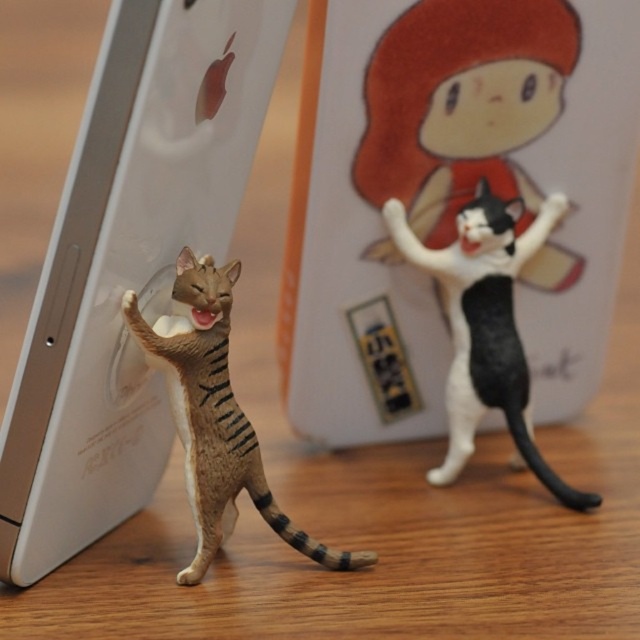
Question: Which object is the farthest from the brown striped cat at center?

Choices:
 (A) matte white phone at left
 (B) black and white plastic cat at right

Answer: (B)

Question: Based on their relative distances, which object is farther from the brown striped cat at center?

Choices:
 (A) black and white plastic cat at right
 (B) matte white phone at left

Answer: (A)

Question: Can you confirm if matte white phone at left is positioned to the left of black and white plastic cat at right?

Choices:
 (A) yes
 (B) no

Answer: (A)

Question: Which point is closer to the camera taking this photo?

Choices:
 (A) (513, 275)
 (B) (225, 486)
 (C) (115, 228)

Answer: (C)

Question: Is black and white plastic cat at right positioned at the back of brown striped cat at center?

Choices:
 (A) no
 (B) yes

Answer: (B)

Question: Is black and white plastic cat at right smaller than brown striped cat at center?

Choices:
 (A) no
 (B) yes

Answer: (B)